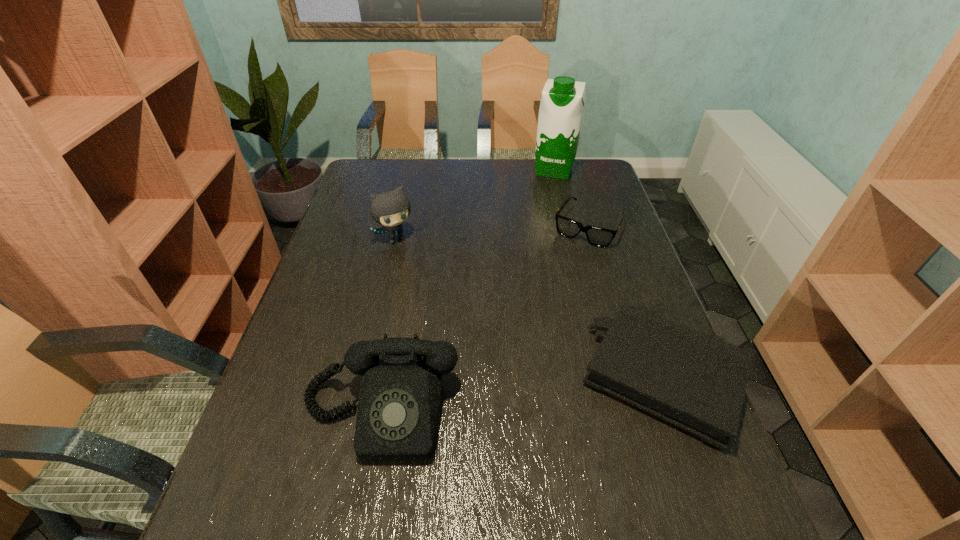
The height and width of the screenshot is (540, 960). I want to click on vacant spot on the desktop that is between the telephone and the Bible and is positioned on the front-facing side of the sunglasses, so click(487, 399).

What are the coordinates of `free spot on the desktop that is between the telephone and the Bible and is positioned on the front-facing side of the tallest object` in the screenshot? It's located at (487, 399).

Locate an element on the screen. The width and height of the screenshot is (960, 540). vacant spot on the desktop that is between the telephone and the fourth tallest object and is positioned on the front-facing side of the kitten is located at coordinates (499, 397).